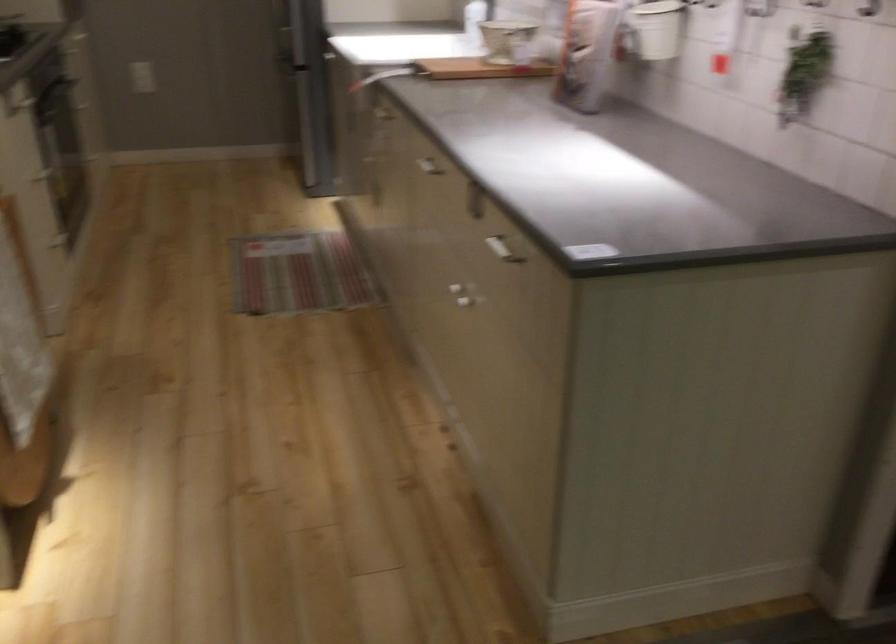
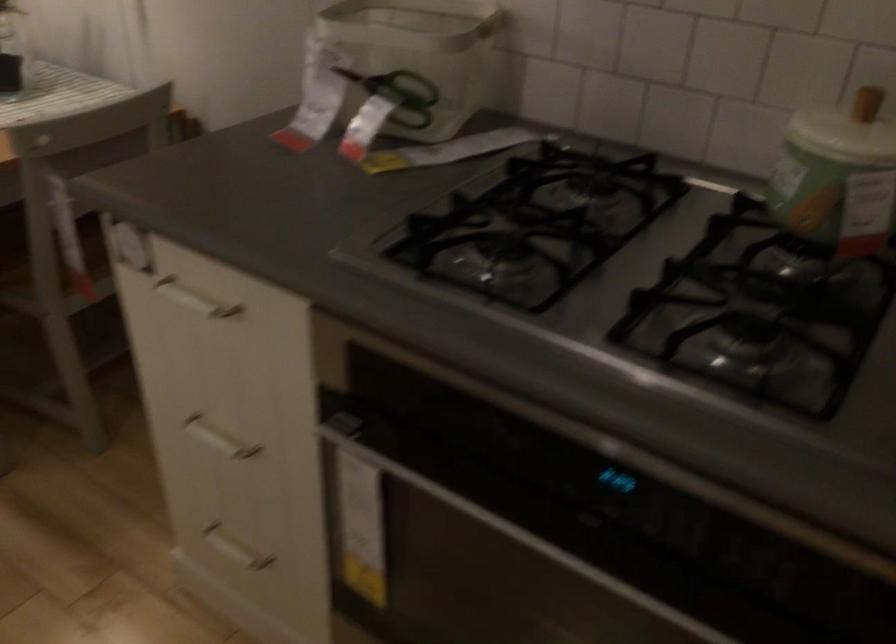
Locate, in the second image, the point that corresponds to pixel 70 252 in the first image.

(234, 549)